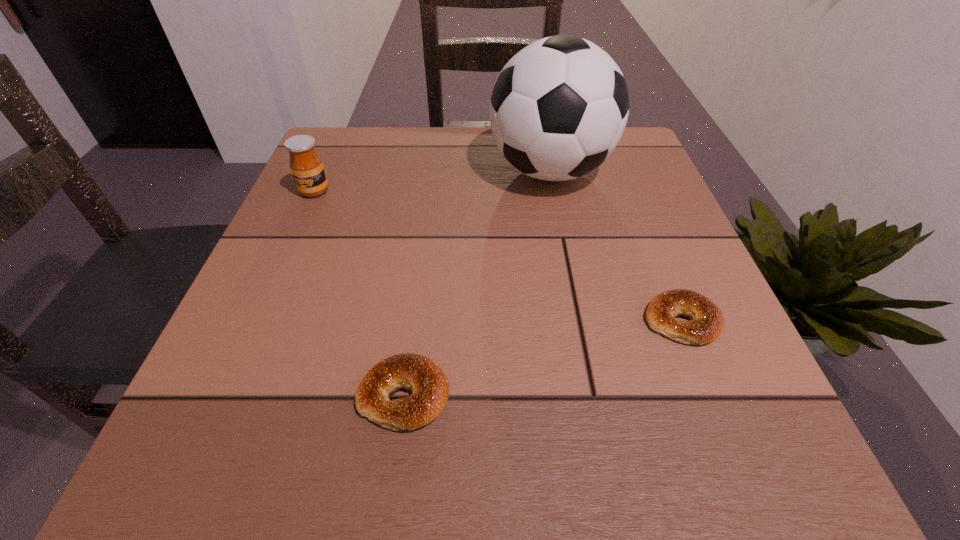
At what (x,y) coordinates should I click in order to perform the action: click on vacant area at the near edge of the desktop. Please return your answer as a coordinate pair (x, y). Image resolution: width=960 pixels, height=540 pixels. Looking at the image, I should click on (571, 464).

At what (x,y) coordinates should I click in order to perform the action: click on free space at the left edge of the desktop. Please return your answer as a coordinate pair (x, y). Image resolution: width=960 pixels, height=540 pixels. Looking at the image, I should click on (271, 249).

The height and width of the screenshot is (540, 960). I want to click on vacant space at the right edge, so click(630, 234).

What are the coordinates of `vacant position at the far left corner of the desktop` in the screenshot? It's located at (329, 174).

In the image, there is a desktop. Where is `vacant space at the far right corner`? The height and width of the screenshot is (540, 960). vacant space at the far right corner is located at coordinates (591, 173).

Image resolution: width=960 pixels, height=540 pixels. What are the coordinates of `free location at the near right corner` in the screenshot? It's located at (771, 433).

At what (x,y) coordinates should I click in order to perform the action: click on free space between the right bagel and the second tallest object. Please return your answer as a coordinate pair (x, y). Looking at the image, I should click on (498, 256).

In order to click on unoccupied area between the right bagel and the second object from left to right in this screenshot , I will do `click(543, 358)`.

Find the location of `free space between the soccer ball and the second object from left to right`. free space between the soccer ball and the second object from left to right is located at coordinates click(x=477, y=283).

Locate an element on the screen. Image resolution: width=960 pixels, height=540 pixels. free spot between the soccer ball and the honey is located at coordinates (432, 181).